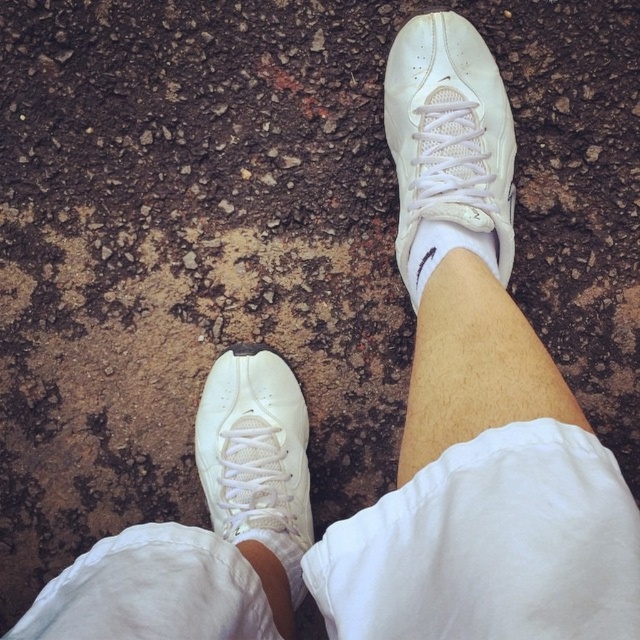
Looking at this image, is white leather sneaker at center taller than white matte skin at center?

Yes, white leather sneaker at center is taller than white matte skin at center.

Find the location of a particular element. white leather sneaker at center is located at coordinates 257,456.

Based on the photo, is white leather sneaker at center taller than white smooth skin at lower center?

→ Yes, white leather sneaker at center is taller than white smooth skin at lower center.

Does white leather sneaker at center have a lesser height compared to white smooth skin at lower center?

No, white leather sneaker at center is not shorter than white smooth skin at lower center.

Identify the location of white leather sneaker at center. (257, 456).

What are the coordinates of `white leather sneaker at center` in the screenshot? It's located at (257, 456).

Between white mesh shoe at center and white matte skin at center, which one is positioned higher?

white mesh shoe at center is higher up.

Which is in front, point (461, 67) or point (465, 243)?

Point (465, 243) is in front.

Does point (403, 84) come closer to viewer compared to point (422, 227)?

That is False.

At what (x,y) coordinates should I click in order to perform the action: click on white mesh shoe at center. Please return your answer as a coordinate pair (x, y). The image size is (640, 640). Looking at the image, I should click on (449, 132).